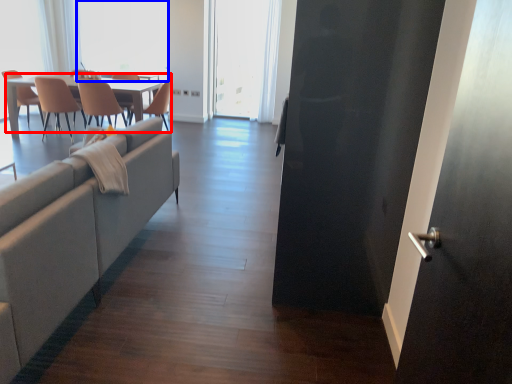
Question: Which object appears closest to the camera in this image, kitchen & dining room table (highlighted by a red box) or window screen (highlighted by a blue box)?

Choices:
 (A) kitchen & dining room table
 (B) window screen

Answer: (A)